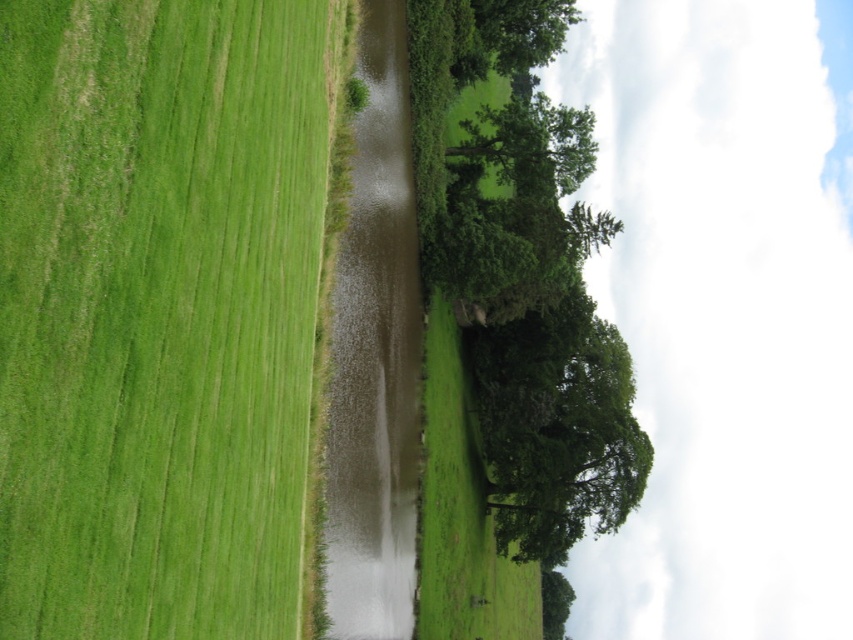
From the picture: You are a farmer checking the growth of your crops. You notice the green grass at left and the green leafy tree at upper center. Which one is shorter?

The green grass at left is shorter than the green leafy tree at upper center.

You are a bird looking for a place to perch. You see the green leafy tree at center and the muddy water at center. Which one is taller?

The green leafy tree at center is taller than the muddy water at center.